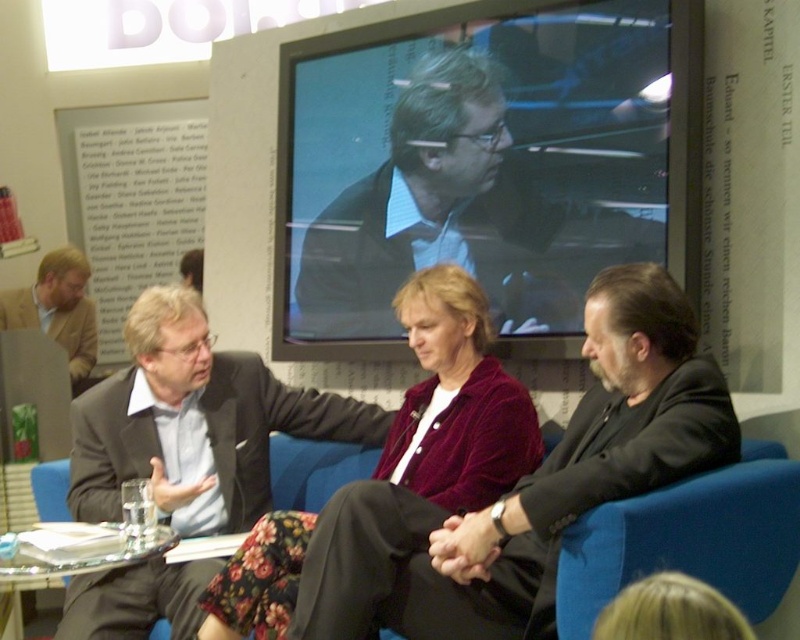
You are organizing a photoshoot and need to know the relative sizes of the objects in the scene. Which object is larger, the black velvet suit at center or the clear glass table at lower left?

The black velvet suit at center is bigger than the clear glass table at lower left according to the description.

Based on the scene description, can you determine if the black velvet suit at center is positioned higher than the clear glass table at lower left?

Yes, the black velvet suit at center is above the clear glass table at lower left, so it is positioned higher.

You are sitting in the blue fabric armchair at lower right and want to hand a document to the person wearing the light brown suit at left. Can you reach them without getting up?

The blue fabric armchair at lower right is in front of the light brown suit at left, so you are closer to them. You can likely reach them without getting up.